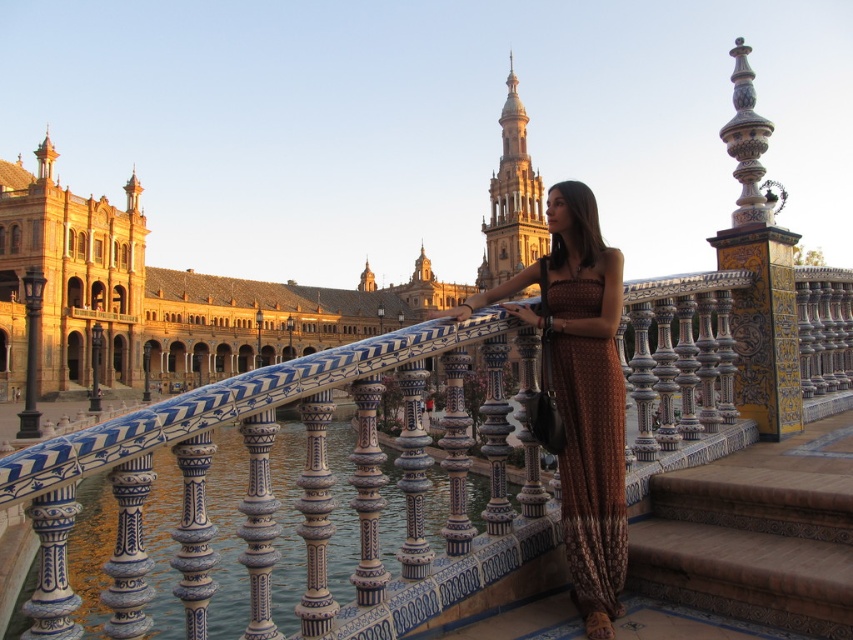
You are standing in the plaza and want to take a photo of the brown textured dress at center while avoiding the blue and white ceramic rail at center appearing in the frame. Is it possible to do so without moving either object?

The blue and white ceramic rail at center is closer to the viewer than the brown textured dress at center, so the rail would block the view of the dress unless moved. Therefore, it is not possible to take the photo without moving either object.

You are a tourist standing in the plaza and want to take a photo of the blue and white ceramic rail at center and the brown woven dress at center. Which object should you focus on first if you want to capture both in a single frame without moving the camera?

You should focus on the blue and white ceramic rail at center first because it is wider than the brown woven dress at center, allowing it to be centered while still capturing the dress in the frame.

Based on the photo, you are standing at the entrance of the plaza and want to locate the blue and white ceramic rail at center. According to the coordinates provided, where should you look to find it?

The blue and white ceramic rail at center is located at coordinates point (297, 499).